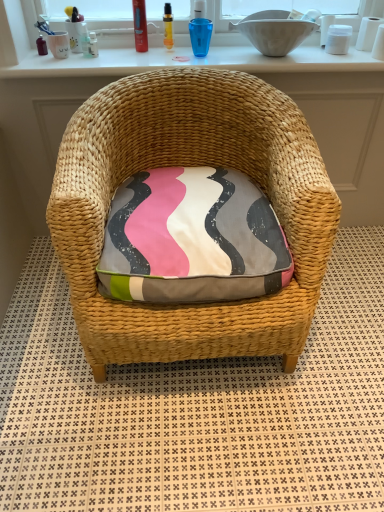
Locate an element on the screen. Image resolution: width=384 pixels, height=512 pixels. vacant space in front of natural woven chair at center is located at coordinates (194, 448).